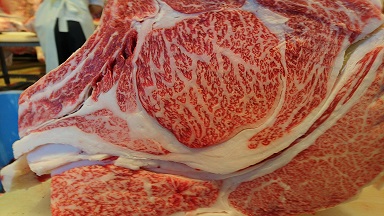
Locate an element on the screen. Image resolution: width=384 pixels, height=216 pixels. chair is located at coordinates (4, 114).